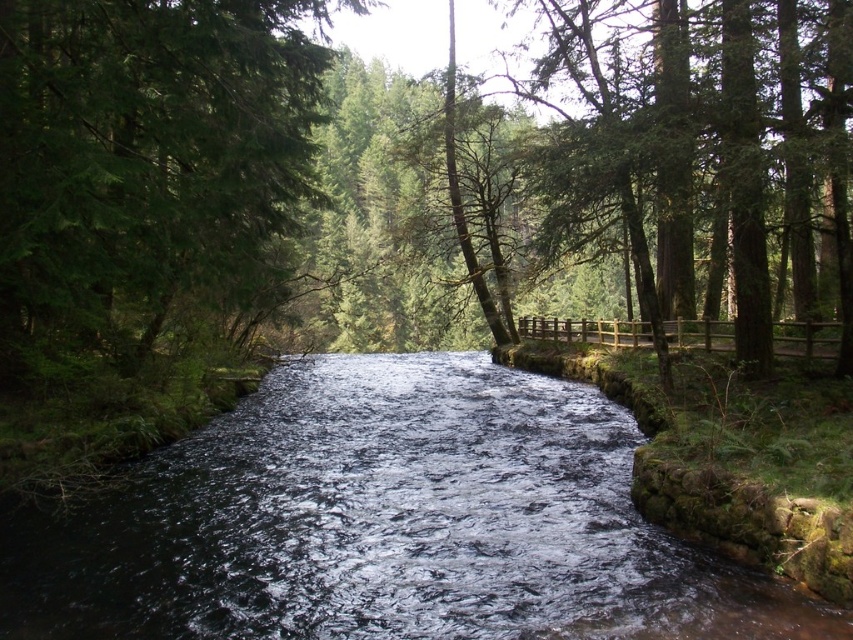
You are a hiker trying to cross the river using a fallen log. You notice the dark water at center and the green textured tree at upper left. Which object is larger in size?

The green textured tree at upper left is larger in size than the dark water at center.

You are a hiker who wants to cross the river using a narrow wooden bridge that is 20 feet long. You see the dark water at center and the green textured tree at upper left. Can you safely cross the river with the bridge without it touching the water?

The dark water at center and green textured tree at upper left are 22.94 feet apart. The bridge is only 20 feet long, so it would not span the entire distance between them. Therefore, the bridge would touch the water, making it unsafe to cross.